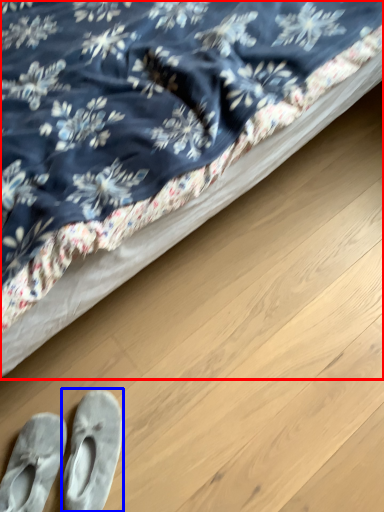
Question: Which object is further to the camera taking this photo, bed (highlighted by a red box) or footwear (highlighted by a blue box)?

Choices:
 (A) bed
 (B) footwear

Answer: (B)